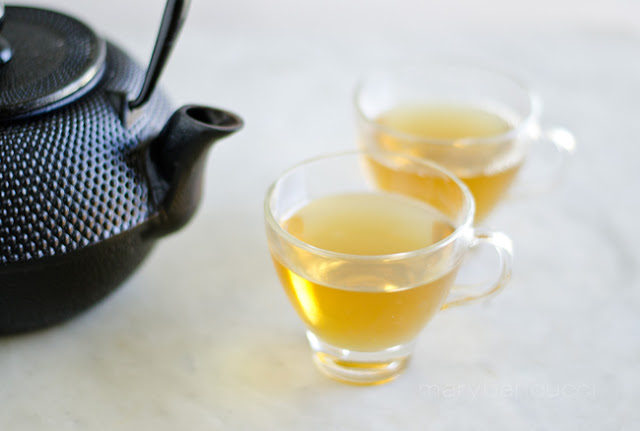
This screenshot has height=431, width=640. In order to click on blurry cup in this screenshot , I will do `click(512, 94)`.